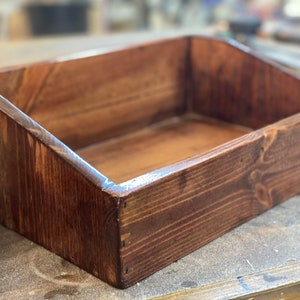
You are a GUI agent. You are given a task and a screenshot of the screen. Output one action in this format:
    pyautogui.click(x=<x>, y=<y>)
    Task: Click on the black mark on wood trim of table top
    
    Given the screenshot: What is the action you would take?
    pyautogui.click(x=241, y=283)